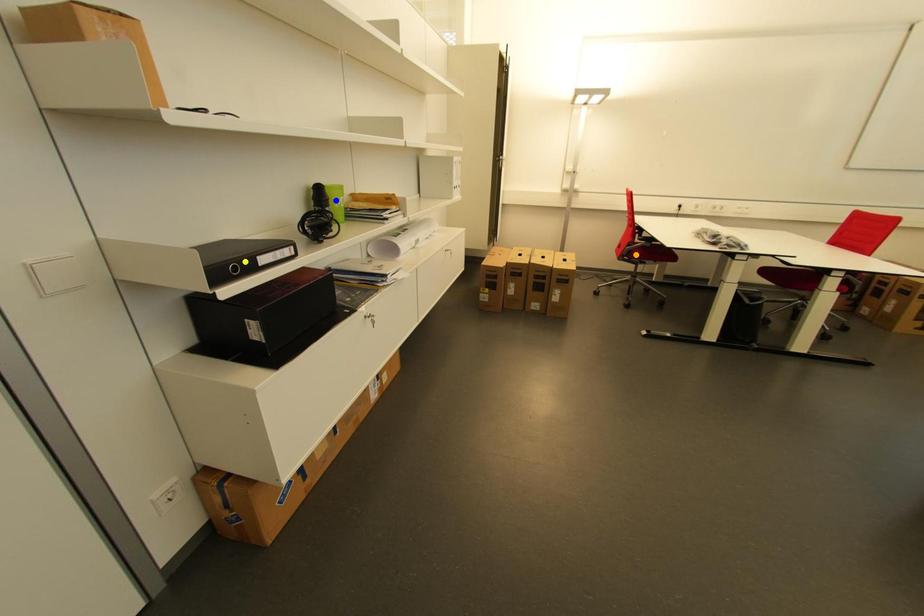
Order these from nearest to farthest:
orange point
blue point
yellow point

yellow point, blue point, orange point